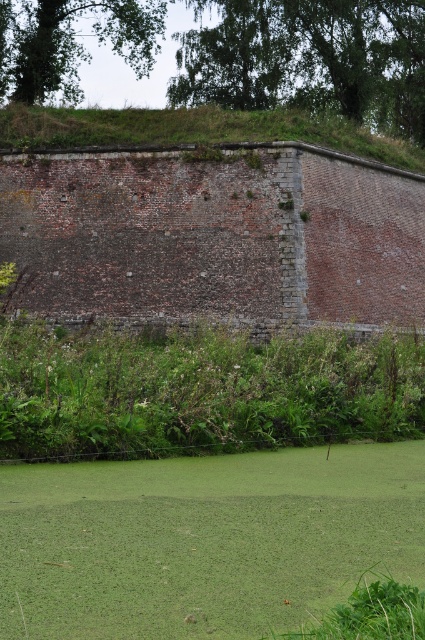
Question: Which object is farther from the camera taking this photo?

Choices:
 (A) green leafy grass at lower center
 (B) green leafy grass at upper center

Answer: (B)

Question: Does green leafy grass at lower center have a greater width compared to green leafy grass at upper center?

Choices:
 (A) yes
 (B) no

Answer: (B)

Question: Does green leafy grass at lower center appear on the left side of green leafy grass at upper center?

Choices:
 (A) yes
 (B) no

Answer: (A)

Question: Is green leafy grass at lower center wider than green leafy grass at upper center?

Choices:
 (A) yes
 (B) no

Answer: (B)

Question: Which point appears farthest from the camera in this image?

Choices:
 (A) [227, 134]
 (B) [214, 502]

Answer: (A)

Question: Which point is farther to the camera?

Choices:
 (A) (169, 124)
 (B) (90, 616)

Answer: (A)